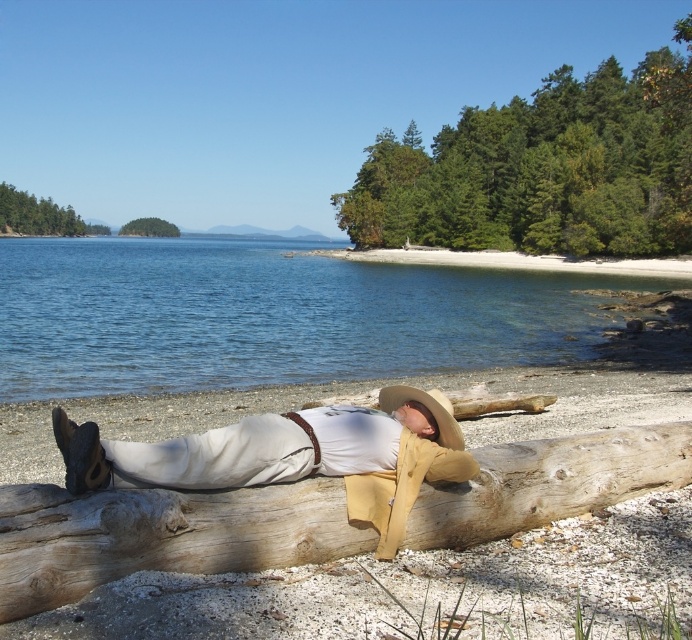
Question: Does light brown wood log at center appear on the left side of light brown leather hat at center?

Choices:
 (A) yes
 (B) no

Answer: (B)

Question: Is clear blue water at center thinner than beige straw cowboy hat at center?

Choices:
 (A) no
 (B) yes

Answer: (A)

Question: Among these objects, which one is nearest to the camera?

Choices:
 (A) clear blue water at center
 (B) light brown wood log at center

Answer: (B)

Question: Considering the relative positions of clear blue water at center and beige straw cowboy hat at center in the image provided, where is clear blue water at center located with respect to beige straw cowboy hat at center?

Choices:
 (A) below
 (B) above

Answer: (B)

Question: Which of the following is the farthest from the observer?

Choices:
 (A) light brown leather hat at center
 (B) beige straw cowboy hat at center
 (C) clear blue water at center
 (D) light brown wood log at center

Answer: (C)

Question: Which point is farther from the camera taking this photo?

Choices:
 (A) (664, 477)
 (B) (206, 268)
 (C) (394, 408)

Answer: (B)